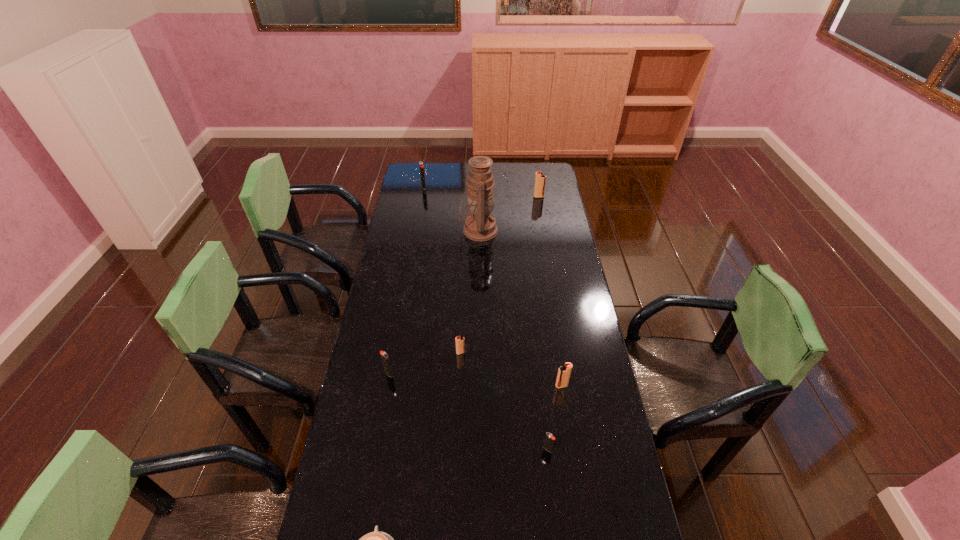
Identify the location of the second nearest red igniter. The image size is (960, 540). (460, 341).

Find the location of a particular element. This screenshot has height=540, width=960. the third igniter from left to right is located at coordinates (460, 341).

At what (x,y) coordinates should I click in order to perform the action: click on the fourth igniter from left to right. Please return your answer as a coordinate pair (x, y). This screenshot has height=540, width=960. Looking at the image, I should click on (549, 441).

This screenshot has height=540, width=960. Find the location of `the nearest igniter`. the nearest igniter is located at coordinates (549, 441).

The image size is (960, 540). What are the coordinates of `free space located 0.170m on the right of the oil lamp` in the screenshot? It's located at (533, 231).

Find the location of a particular element. The height and width of the screenshot is (540, 960). free spot located on the front of the seventh nearest object is located at coordinates (544, 233).

You are a GUI agent. You are given a task and a screenshot of the screen. Output one action in this format:
    pyautogui.click(x=<x>, y=<y>)
    Task: Click on the free space located on the front of the farthest igniter
    The image size is (960, 540).
    Given the screenshot: What is the action you would take?
    pyautogui.click(x=420, y=207)

Locate an element on the screen. The image size is (960, 540). vacant position located 0.170m on the right of the second biggest black igniter is located at coordinates (442, 374).

You are a GUI agent. You are given a task and a screenshot of the screen. Output one action in this format:
    pyautogui.click(x=<x>, y=<y>)
    Task: Click on the vacant region located 0.050m on the front of the fifth farthest igniter
    
    Given the screenshot: What is the action you would take?
    pyautogui.click(x=564, y=402)

The image size is (960, 540). Identify the location of free space located on the front of the smallest red igniter. (457, 452).